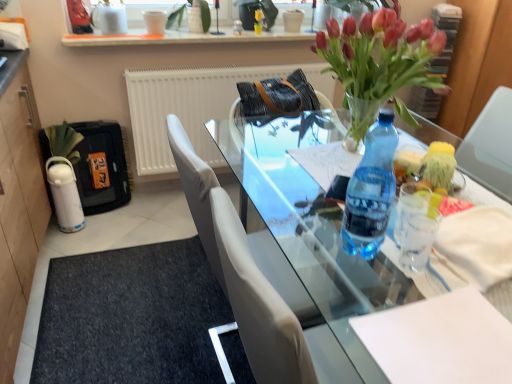
Question: Is black rubber doormat at lower left in front of or behind leather at center in the image?

Choices:
 (A) front
 (B) behind

Answer: (A)

Question: In terms of height, does black rubber doormat at lower left look taller or shorter compared to leather at center?

Choices:
 (A) tall
 (B) short

Answer: (B)

Question: Which object is positioned farthest from the white paper at center?

Choices:
 (A) leather at center
 (B) white matte flowerpot at upper center
 (C) transparent glass table at center
 (D) white matte radiator at upper center
 (E) black rubber doormat at lower left

Answer: (B)

Question: Which is nearer to the white matte radiator at upper center?

Choices:
 (A) white glossy shelf at upper center
 (B) transparent glass table at center
 (C) black rubber doormat at lower left
 (D) white plastic corded phone at upper left
 (E) white matte flowerpot at upper center

Answer: (A)